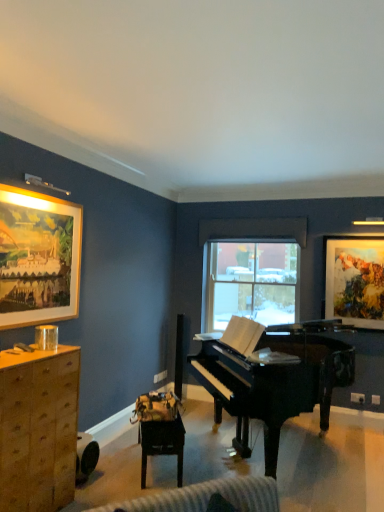
Question: From a real-world perspective, is wooden cabinet at left positioned above or below wooden framed painting at upper left, acting as the second picture frame starting from the back?

Choices:
 (A) above
 (B) below

Answer: (B)

Question: From the image's perspective, relative to wooden framed painting at upper left, acting as the second picture frame starting from the back, is wooden cabinet at left above or below?

Choices:
 (A) below
 (B) above

Answer: (A)

Question: Based on their relative distances, which object is nearer to the wooden table at center?

Choices:
 (A) wooden framed painting at upper left, acting as the second picture frame starting from the back
 (B) glossy black piano at center
 (C) wooden cabinet at left
 (D) watercolor paper painting at upper right, which appears as the first picture frame when viewed from the back

Answer: (C)

Question: Estimate the real-world distances between objects in this image. Which object is closer to the wooden framed painting at upper left, acting as the second picture frame starting from the back?

Choices:
 (A) watercolor paper painting at upper right, positioned as the 1th picture frame in right-to-left order
 (B) wooden cabinet at left
 (C) wooden table at center
 (D) glossy black piano at center

Answer: (B)